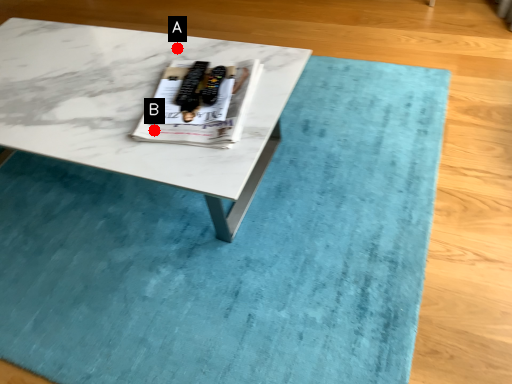
Question: Two points are circled on the image, labeled by A and B beside each circle. Which point is closer to the camera?

Choices:
 (A) A is closer
 (B) B is closer

Answer: (B)